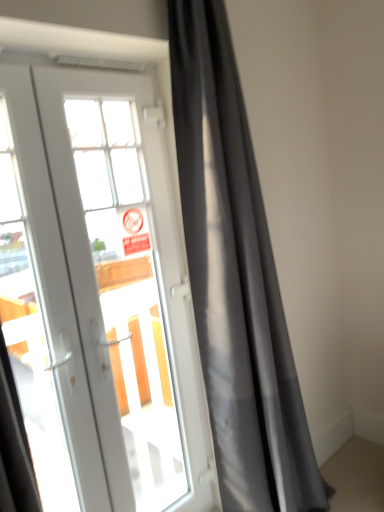
Question: In the image, is matte gray curtain at center positioned in front of or behind white glass door at center?

Choices:
 (A) front
 (B) behind

Answer: (B)

Question: From the image's perspective, is matte gray curtain at center above or below white glass door at center?

Choices:
 (A) below
 (B) above

Answer: (B)

Question: Looking at their shapes, would you say matte gray curtain at center is wider or thinner than white glass door at center?

Choices:
 (A) wide
 (B) thin

Answer: (A)

Question: Does point [110, 275] appear closer or farther from the camera than point [216, 209]?

Choices:
 (A) farther
 (B) closer

Answer: (A)

Question: Is white glass door at center wider or thinner than matte gray curtain at center?

Choices:
 (A) wide
 (B) thin

Answer: (B)

Question: In terms of height, does white glass door at center look taller or shorter compared to matte gray curtain at center?

Choices:
 (A) tall
 (B) short

Answer: (B)

Question: From a real-world perspective, is white glass door at center above or below matte gray curtain at center?

Choices:
 (A) above
 (B) below

Answer: (B)